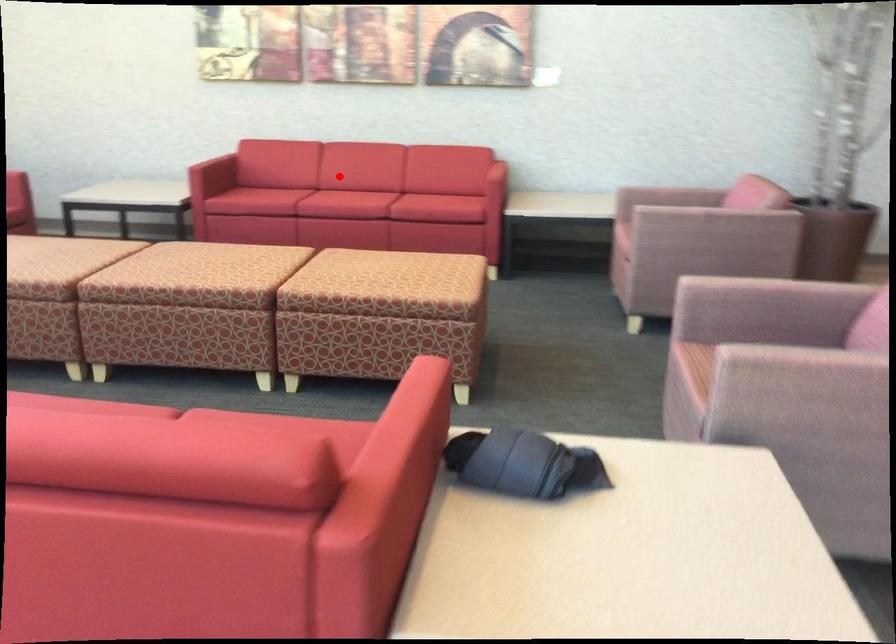
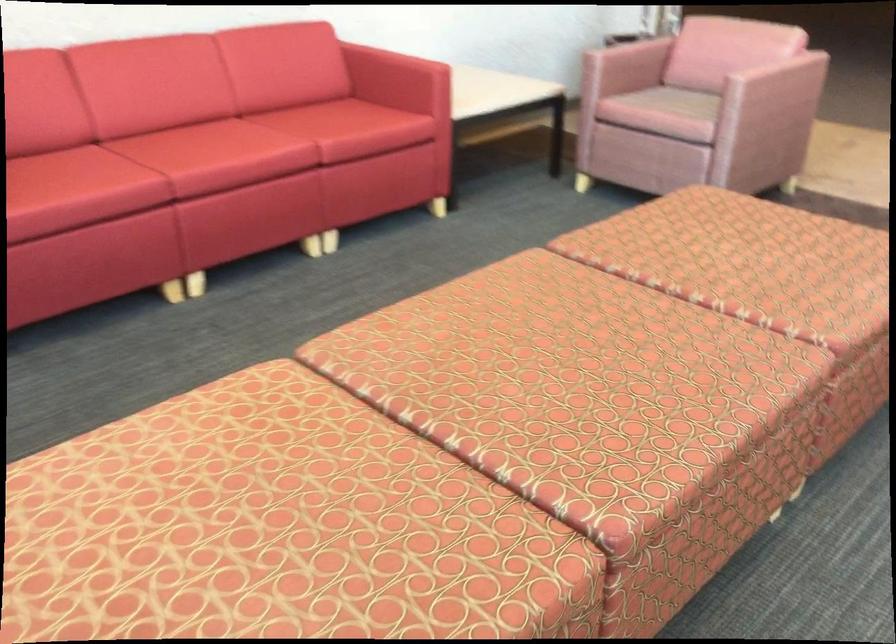
Find the pixel in the second image that matches the highlighted location in the first image.

(196, 144)